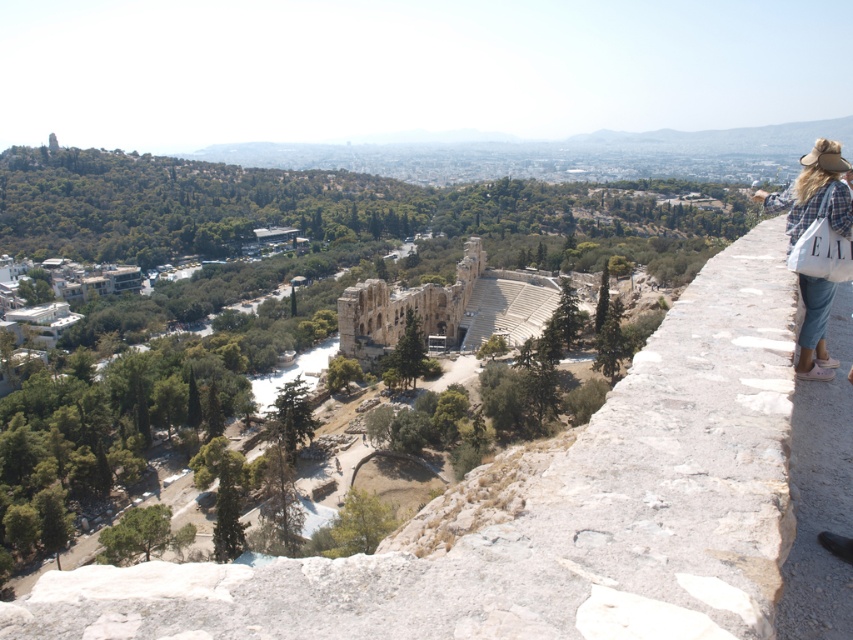
Who is positioned more to the right, beige stone amphitheater at center or blue denim jeans at right?

blue denim jeans at right

I want to click on beige stone amphitheater at center, so click(x=431, y=308).

Identify the location of beige stone amphitheater at center. This screenshot has height=640, width=853. pyautogui.click(x=431, y=308).